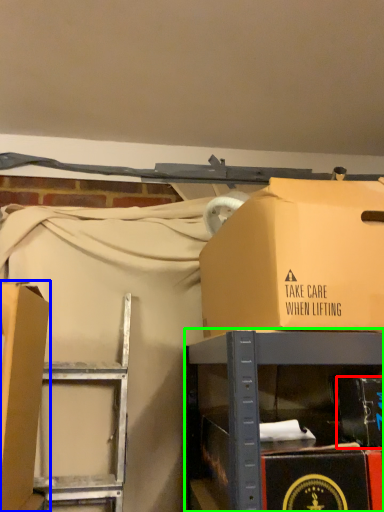
Question: Estimate the real-world distances between objects in this image. Which object is farther from box (highlighted by a red box), box (highlighted by a blue box) or furniture (highlighted by a green box)?

Choices:
 (A) box
 (B) furniture

Answer: (A)